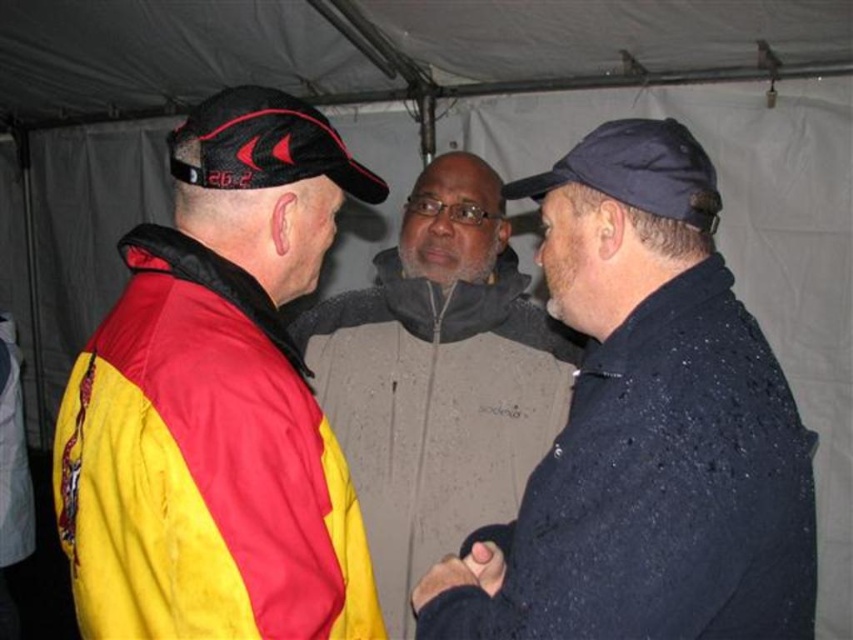
Question: Which of the following is the farthest from the observer?

Choices:
 (A) black matte hand at center
 (B) matte black jacket at center
 (C) dark blue textured jacket at center

Answer: (B)

Question: Is yellow/red jacket at left closer to the viewer compared to black leather glove at center?

Choices:
 (A) yes
 (B) no

Answer: (A)

Question: Which point is closer to the camera?

Choices:
 (A) black matte hand at center
 (B) navy blue fabric baseball cap at center

Answer: (B)

Question: Is the position of matte black jacket at center more distant than that of navy blue fabric baseball cap at center?

Choices:
 (A) no
 (B) yes

Answer: (B)

Question: Among these points, which one is nearest to the camera?

Choices:
 (A) (221, 116)
 (B) (444, 586)
 (C) (485, 588)
 (D) (149, 445)

Answer: (D)

Question: From the image, what is the correct spatial relationship of yellow/red jacket at left in relation to matte black jacket at center?

Choices:
 (A) right
 (B) left

Answer: (B)